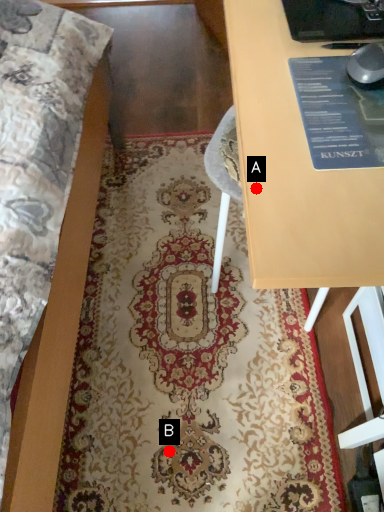
Question: Two points are circled on the image, labeled by A and B beside each circle. Which point is further to the camera?

Choices:
 (A) A is further
 (B) B is further

Answer: (B)